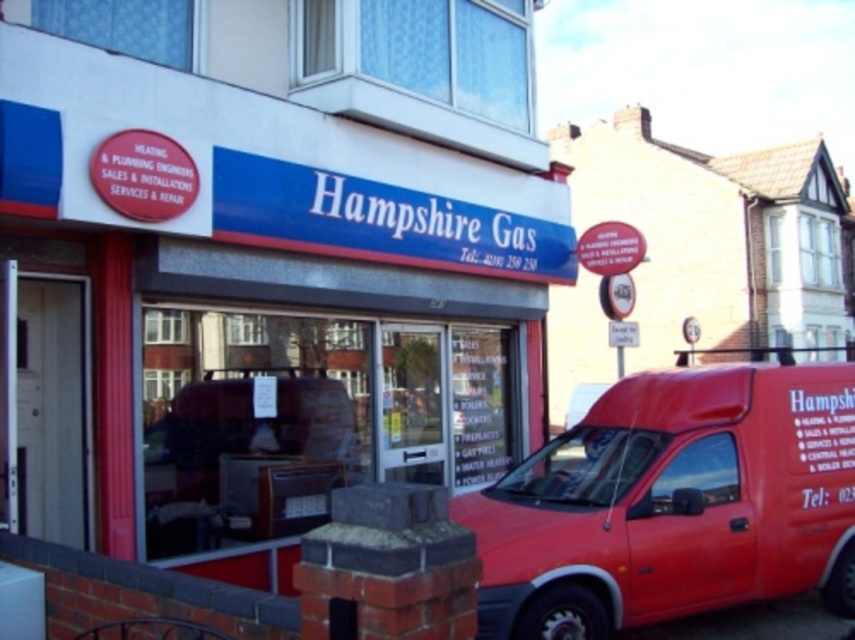
You are standing at the entrance of the Hampshire Gas storefront. There are two points marked on the glass front window at coordinates point (167, 36) and point (549, 524). Which point is closer to the entrance?

Point (549, 524) is closer to the entrance because point (167, 36) is behind it.